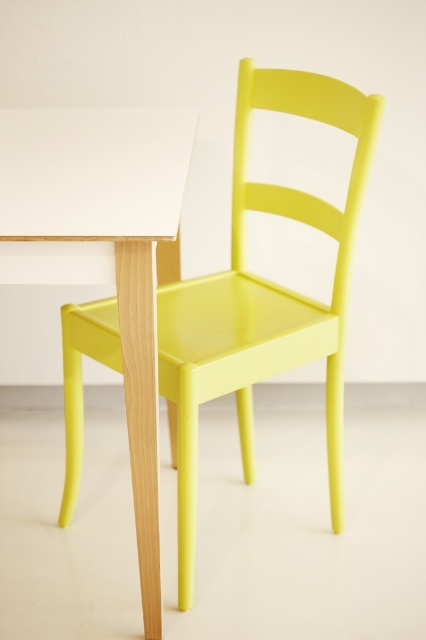
Question: Among these points, which one is farthest from the camera?

Choices:
 (A) click(299, 88)
 (B) click(2, 218)

Answer: (A)

Question: Is lime matte chair at center thinner than white matte table at center?

Choices:
 (A) yes
 (B) no

Answer: (B)

Question: Which object appears closest to the camera in this image?

Choices:
 (A) white matte table at center
 (B) lime matte chair at center

Answer: (A)

Question: Is lime matte chair at center thinner than white matte table at center?

Choices:
 (A) no
 (B) yes

Answer: (A)

Question: Is lime matte chair at center closer to camera compared to white matte table at center?

Choices:
 (A) yes
 (B) no

Answer: (B)